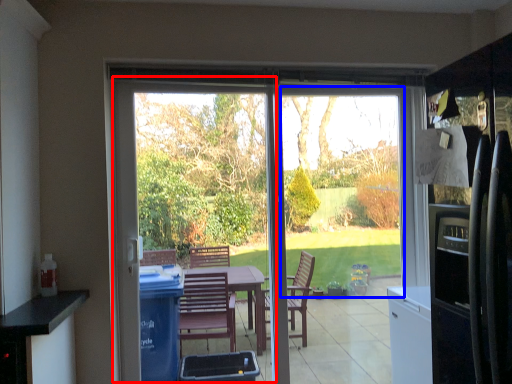
Question: Among these objects, which one is farthest to the camera, screen door (highlighted by a red box) or window screen (highlighted by a blue box)?

Choices:
 (A) screen door
 (B) window screen

Answer: (B)